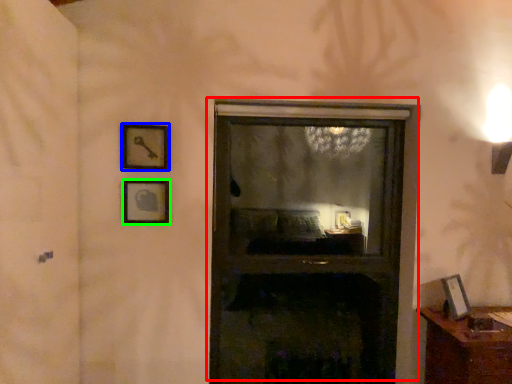
Question: Which is farther away from window (highlighted by a red box)? picture frame (highlighted by a blue box) or picture frame (highlighted by a green box)?

Choices:
 (A) picture frame
 (B) picture frame

Answer: (A)